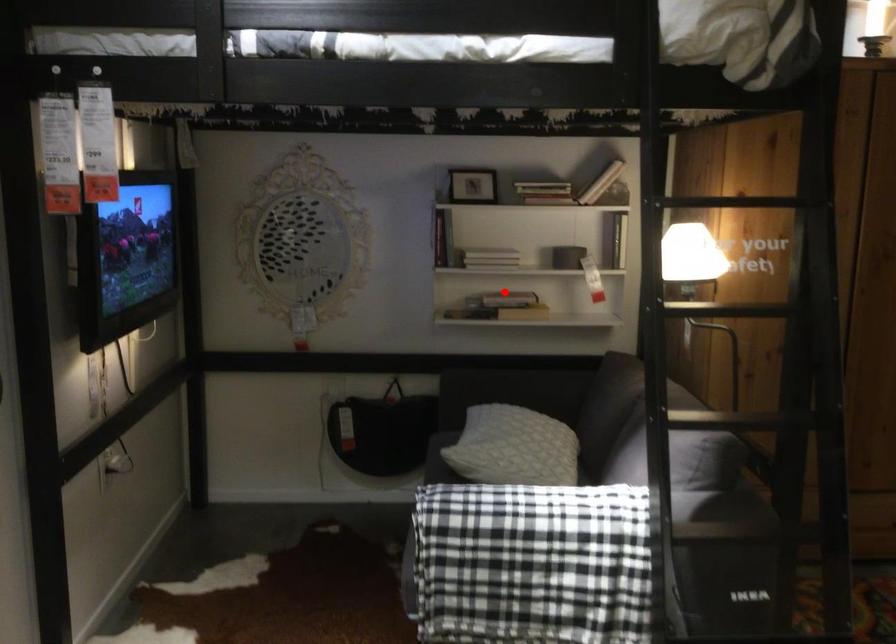
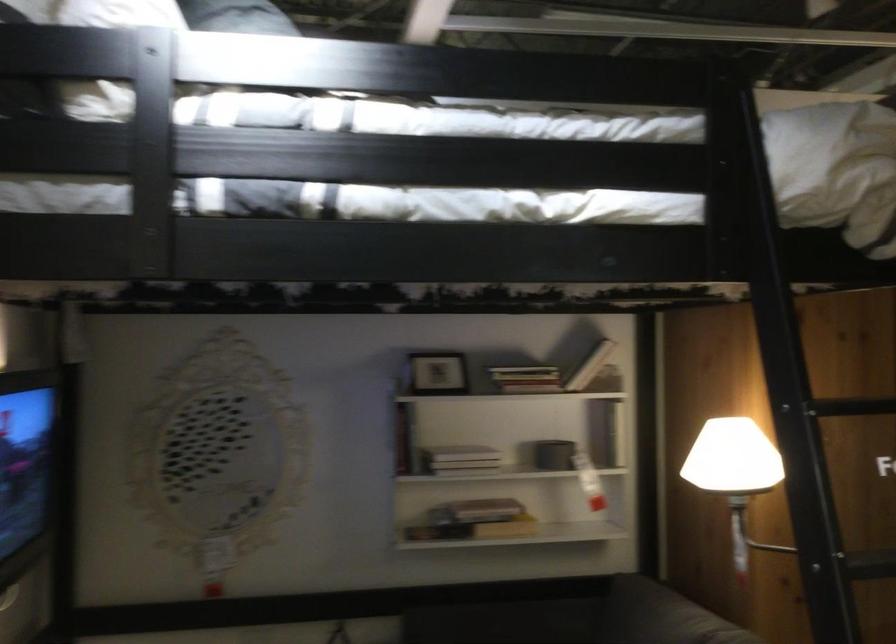
Question: A red point is marked in image1. In image2, is the corresponding 3D point closer to the camera or farther? Reply with the corresponding letter.

Choices:
 (A) The corresponding 3D point is closer.
 (B) The corresponding 3D point is farther.

Answer: (A)